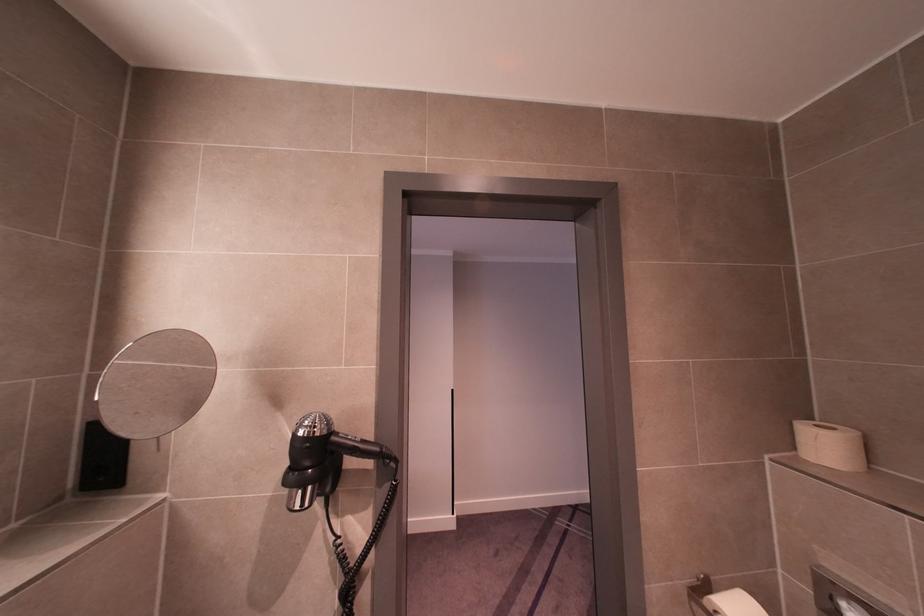
Identify the location of round magnifying mirror. (155, 384).